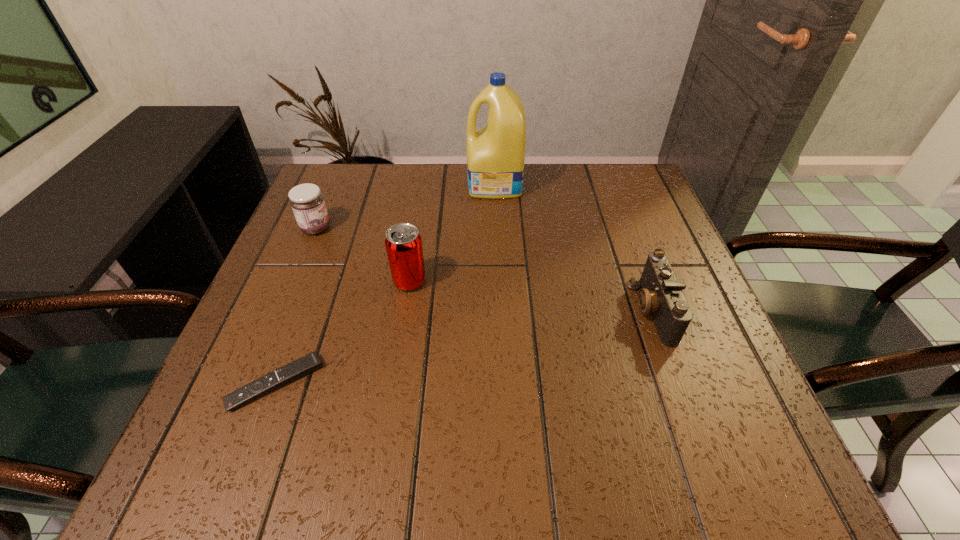
Image resolution: width=960 pixels, height=540 pixels. What are the coordinates of `vacant space located 0.090m on the label of the farthest object` in the screenshot? It's located at (435, 185).

Identify the location of vacant space located 0.190m on the label of the farthest object. (397, 185).

Where is `free space located on the front of the soda can`? The height and width of the screenshot is (540, 960). free space located on the front of the soda can is located at coordinates (396, 368).

The image size is (960, 540). Identify the location of vacant space located on the front label of the jam. (389, 228).

Where is `free region located on the front-facing side of the rightmost object`? free region located on the front-facing side of the rightmost object is located at coordinates (444, 310).

This screenshot has height=540, width=960. I want to click on free space located 0.380m on the front-facing side of the rightmost object, so click(444, 310).

Find the location of a particular element. The height and width of the screenshot is (540, 960). vacant area situated on the front-facing side of the rightmost object is located at coordinates (543, 310).

This screenshot has height=540, width=960. In order to click on free space located 0.360m on the back of the nearest object in this screenshot , I will do `click(332, 231)`.

Identify the location of object located at the far edge. (496, 153).

Where is `jam present at the left edge`? Image resolution: width=960 pixels, height=540 pixels. jam present at the left edge is located at coordinates (306, 201).